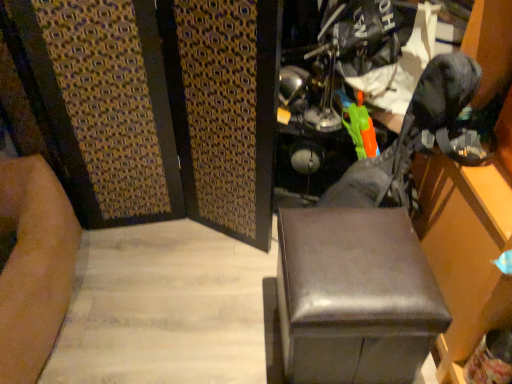
Describe the element at coordinates (368, 258) in the screenshot. I see `leather swivel chair at center` at that location.

Measure the distance between leather swivel chair at center and camera.

leather swivel chair at center and camera are 3.46 feet apart from each other.

Identify the location of leather swivel chair at center. (368, 258).

The image size is (512, 384). Describe the element at coordinates (355, 297) in the screenshot. I see `shiny brown ottoman at center` at that location.

The image size is (512, 384). Identify the location of shiny brown ottoman at center. (355, 297).

Locate an element on the screen. leather swivel chair at center is located at coordinates point(368,258).

Is leather swivel chair at center at the left side of shiny brown ottoman at center?

In fact, leather swivel chair at center is to the right of shiny brown ottoman at center.

From the picture: Relative to shiny brown ottoman at center, is leather swivel chair at center in front or behind?

In the image, leather swivel chair at center appears in front of shiny brown ottoman at center.

Considering the positions of points (376, 337) and (288, 315), is point (376, 337) farther from camera compared to point (288, 315)?

Yes, it is behind point (288, 315).

From the image's perspective, does leather swivel chair at center appear higher than shiny brown ottoman at center?

Yes.

From a real-world perspective, between leather swivel chair at center and shiny brown ottoman at center, who is vertically higher?

leather swivel chair at center.

Looking at their sizes, would you say leather swivel chair at center is wider or thinner than shiny brown ottoman at center?

In the image, leather swivel chair at center appears to be more narrow than shiny brown ottoman at center.

Considering the sizes of objects leather swivel chair at center and shiny brown ottoman at center in the image provided, who is taller, leather swivel chair at center or shiny brown ottoman at center?

Standing taller between the two is leather swivel chair at center.

Is leather swivel chair at center bigger or smaller than shiny brown ottoman at center?

leather swivel chair at center is bigger than shiny brown ottoman at center.

In the scene shown: Can we say leather swivel chair at center lies outside shiny brown ottoman at center?

That's correct, leather swivel chair at center is outside of shiny brown ottoman at center.

Is there a large distance between leather swivel chair at center and shiny brown ottoman at center?

leather swivel chair at center is near shiny brown ottoman at center, not far away.

Could you tell me if leather swivel chair at center is turned towards shiny brown ottoman at center?

Yes, leather swivel chair at center is turned towards shiny brown ottoman at center.

Locate an element on the screen. The height and width of the screenshot is (384, 512). swivel chair located above the shiny brown ottoman at center (from the image's perspective) is located at coordinates (368, 258).

Between shiny brown ottoman at center and leather swivel chair at center, which one appears on the right side from the viewer's perspective?

From the viewer's perspective, leather swivel chair at center appears more on the right side.

Is shiny brown ottoman at center further to the viewer compared to leather swivel chair at center?

That is True.

Considering the points (284, 252) and (319, 286), which point is behind, point (284, 252) or point (319, 286)?

Point (284, 252)

From the picture: From the image's perspective, is shiny brown ottoman at center located beneath leather swivel chair at center?

Yes.

From a real-world perspective, is shiny brown ottoman at center below leather swivel chair at center?

Correct, in the physical world, shiny brown ottoman at center is lower than leather swivel chair at center.

Can you confirm if shiny brown ottoman at center is wider than leather swivel chair at center?

Yes.

Considering the sizes of objects shiny brown ottoman at center and leather swivel chair at center in the image provided, who is taller, shiny brown ottoman at center or leather swivel chair at center?

leather swivel chair at center is taller.

In terms of size, does shiny brown ottoman at center appear bigger or smaller than leather swivel chair at center?

Clearly, shiny brown ottoman at center is smaller in size than leather swivel chair at center.

Does shiny brown ottoman at center contain leather swivel chair at center?

No, leather swivel chair at center is not surrounded by shiny brown ottoman at center.

Is shiny brown ottoman at center touching leather swivel chair at center?

Yes, shiny brown ottoman at center is in contact with leather swivel chair at center.

Does shiny brown ottoman at center turn towards leather swivel chair at center?

No.

What's the angular difference between shiny brown ottoman at center and leather swivel chair at center's facing directions?

90 degrees.

Identify the location of swivel chair on the right of the shiny brown ottoman at center. (368, 258).

At what (x,y) coordinates should I click in order to perform the action: click on furniture behind the leather swivel chair at center. Please return your answer as a coordinate pair (x, y). The image size is (512, 384). Looking at the image, I should click on (355, 297).

Locate an element on the screen. swivel chair lying in front of the shiny brown ottoman at center is located at coordinates (368, 258).